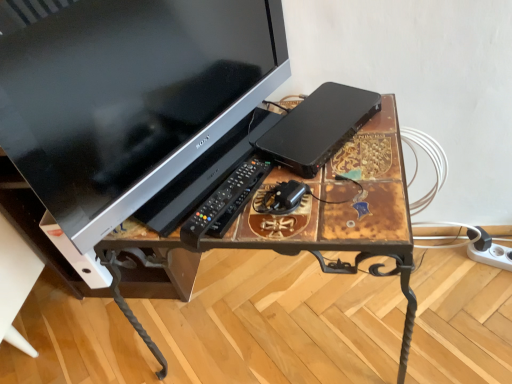
The width and height of the screenshot is (512, 384). Find the location of `free region on the left part of black plastic power adapter at center`. free region on the left part of black plastic power adapter at center is located at coordinates (236, 217).